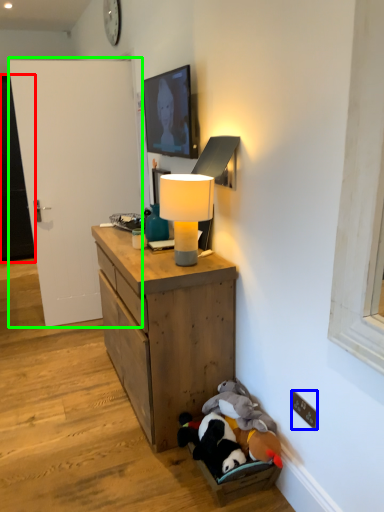
Question: Which is farther away from door (highlighted by a red box)? electric outlet (highlighted by a blue box) or door (highlighted by a green box)?

Choices:
 (A) electric outlet
 (B) door

Answer: (A)